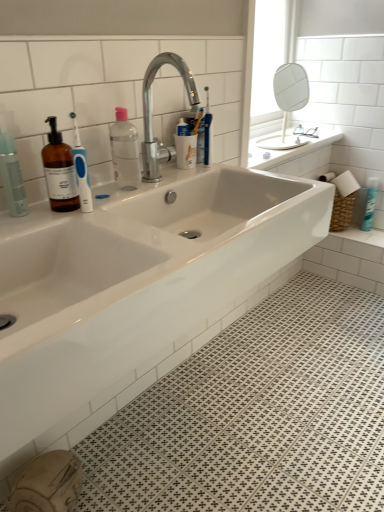
Question: Can you confirm if white glossy sink at upper right is thinner than chrome metallic faucet at upper center?

Choices:
 (A) no
 (B) yes

Answer: (A)

Question: Is white glossy sink at upper right wider than chrome metallic faucet at upper center?

Choices:
 (A) yes
 (B) no

Answer: (A)

Question: Is white glossy sink at upper right smaller than chrome metallic faucet at upper center?

Choices:
 (A) yes
 (B) no

Answer: (B)

Question: Is white glossy sink at upper right closer to camera compared to chrome metallic faucet at upper center?

Choices:
 (A) yes
 (B) no

Answer: (B)

Question: From a real-world perspective, is white glossy sink at upper right over chrome metallic faucet at upper center?

Choices:
 (A) no
 (B) yes

Answer: (A)

Question: Is white glossy sink at upper right shorter than chrome metallic faucet at upper center?

Choices:
 (A) no
 (B) yes

Answer: (B)

Question: Is white glossy spray can at upper right, marked as the first toiletry in a back-to-front arrangement, to the left of transparent plastic bottle at center from the viewer's perspective?

Choices:
 (A) no
 (B) yes

Answer: (A)

Question: Does white glossy spray can at upper right, the second toiletry in the left-to-right sequence, have a larger size compared to transparent plastic bottle at center?

Choices:
 (A) no
 (B) yes

Answer: (A)

Question: Is white glossy spray can at upper right, the first toiletry viewed from the right, taller than transparent plastic bottle at center?

Choices:
 (A) yes
 (B) no

Answer: (A)

Question: Does white glossy spray can at upper right, the second toiletry when ordered from front to back, have a lesser height compared to transparent plastic bottle at center?

Choices:
 (A) yes
 (B) no

Answer: (B)

Question: From the image's perspective, is white glossy spray can at upper right, the second toiletry in the left-to-right sequence, located above transparent plastic bottle at center?

Choices:
 (A) yes
 (B) no

Answer: (B)

Question: Is white glossy spray can at upper right, marked as the first toiletry in a back-to-front arrangement, not within transparent plastic bottle at center?

Choices:
 (A) no
 (B) yes

Answer: (B)

Question: Does white glossy sink at center appear on the left side of white glossy sink at upper right?

Choices:
 (A) yes
 (B) no

Answer: (A)